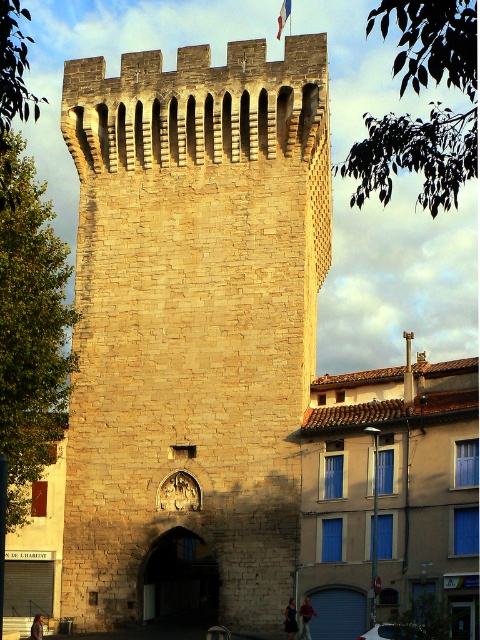
You are standing at the coordinates 0.5, 0.4 in a European town. You want to enter the stone tower at center. Which direction should you move to reach the tower?

Since you are already at the coordinates (192, 320), which is very close to the stone tower at center located at (193, 317), you can move directly towards it without needing to adjust your direction significantly.

You are a medieval knight standing at the base of the stone tower at center. You notice a blue fabric flag at upper center. In which direction relative to the tower is the flag positioned?

The blue fabric flag at upper center is positioned above the stone tower at center.